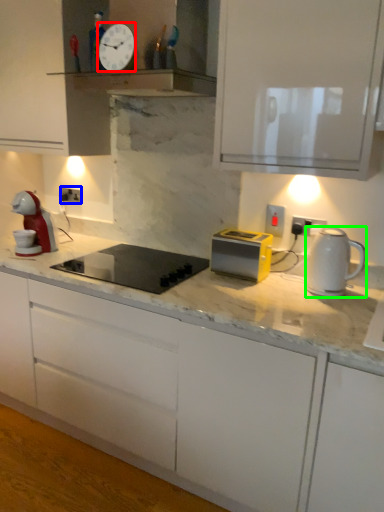
Question: Estimate the real-world distances between objects in this image. Which object is farther from clock (highlighted by a red box), electric outlet (highlighted by a blue box) or kitchen appliance (highlighted by a green box)?

Choices:
 (A) electric outlet
 (B) kitchen appliance

Answer: (B)